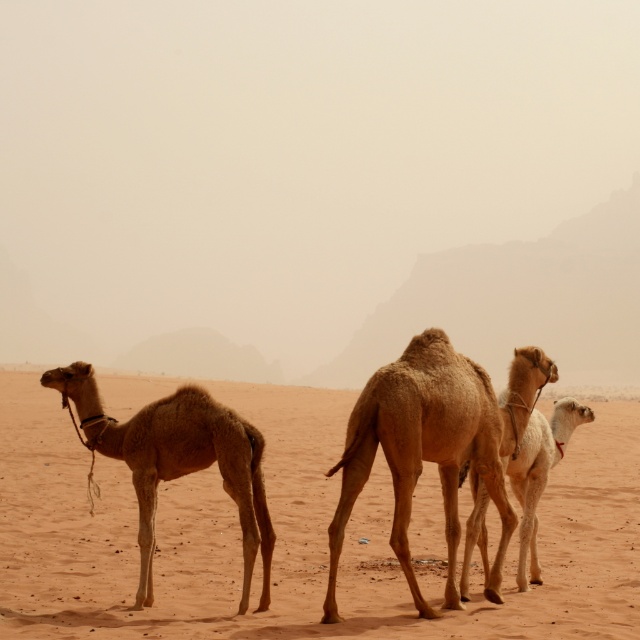
Question: Does sandy beige desert at center appear over light brown textured camel at left?

Choices:
 (A) yes
 (B) no

Answer: (B)

Question: Can you confirm if brown textured camel at center is positioned above light brown textured camel at left?

Choices:
 (A) yes
 (B) no

Answer: (A)

Question: Based on their relative distances, which object is nearer to the light brown smooth camel at center?

Choices:
 (A) brown textured camel at center
 (B) sandy beige desert at center

Answer: (A)

Question: Which of the following is the closest to the observer?

Choices:
 (A) (360, 483)
 (B) (387, 513)
 (C) (483, 493)

Answer: (A)

Question: Is light brown textured camel at left positioned at the back of light brown smooth camel at center?

Choices:
 (A) no
 (B) yes

Answer: (A)

Question: Which point is farther to the camera?

Choices:
 (A) light brown smooth camel at center
 (B) brown textured camel at center

Answer: (A)